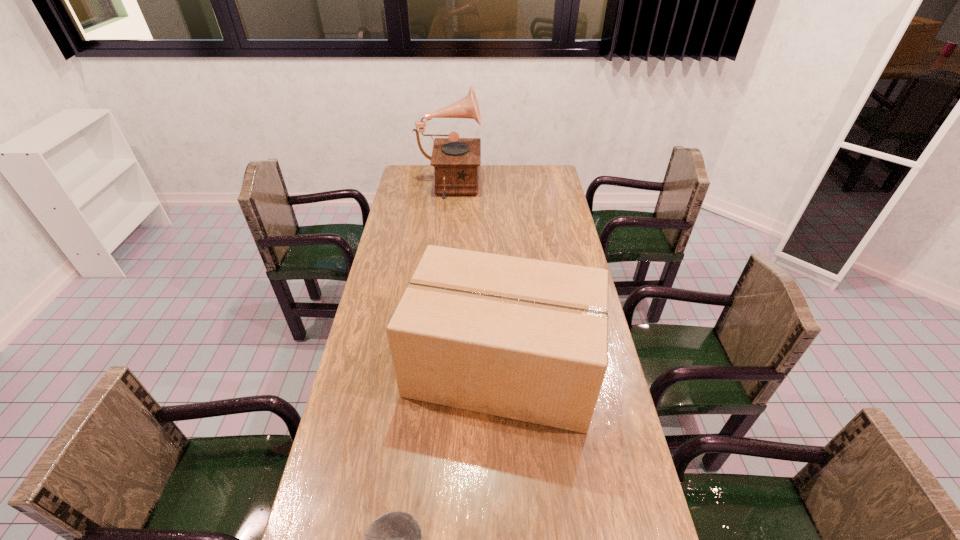
I want to click on object that is at the far left corner, so click(x=456, y=160).

Find the location of a particular element. blank space at the far edge of the desktop is located at coordinates (488, 174).

The width and height of the screenshot is (960, 540). I want to click on free space at the left edge, so click(x=414, y=243).

This screenshot has height=540, width=960. In the image, there is a desktop. What are the coordinates of `free space at the right edge` in the screenshot? It's located at (560, 210).

Image resolution: width=960 pixels, height=540 pixels. Find the location of `vacant space at the far right corner of the desktop`. vacant space at the far right corner of the desktop is located at coordinates (558, 174).

Select which object is the second closest to the farthest object. Please provide its 2D coordinates. Your answer should be formatted as a tuple, i.e. [(x, y)], where the tuple contains the x and y coordinates of a point satisfying the conditions above.

[(395, 539)]

Identify which object is located as the second nearest to the nearest object. Please provide its 2D coordinates. Your answer should be formatted as a tuple, i.e. [(x, y)], where the tuple contains the x and y coordinates of a point satisfying the conditions above.

[(456, 160)]

This screenshot has width=960, height=540. What are the coordinates of `vacant space that satisfies the following two spatial constraints: 1. on the horn of the farthest object; 2. on the back side of the box` in the screenshot? It's located at (431, 366).

This screenshot has width=960, height=540. Find the location of `vacant space that satisfies the following two spatial constraints: 1. on the horn of the farthest object; 2. on the left side of the second farthest object`. vacant space that satisfies the following two spatial constraints: 1. on the horn of the farthest object; 2. on the left side of the second farthest object is located at coordinates (431, 366).